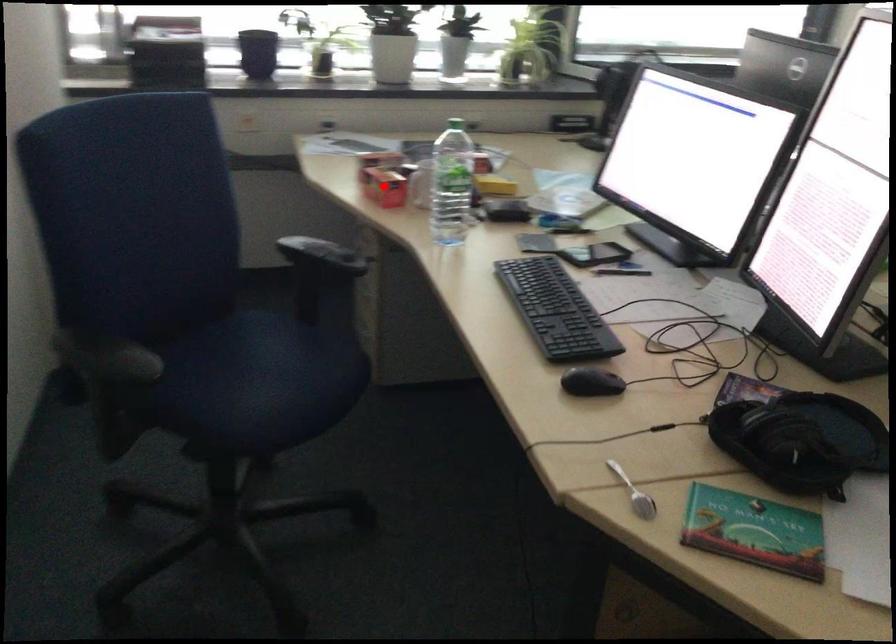
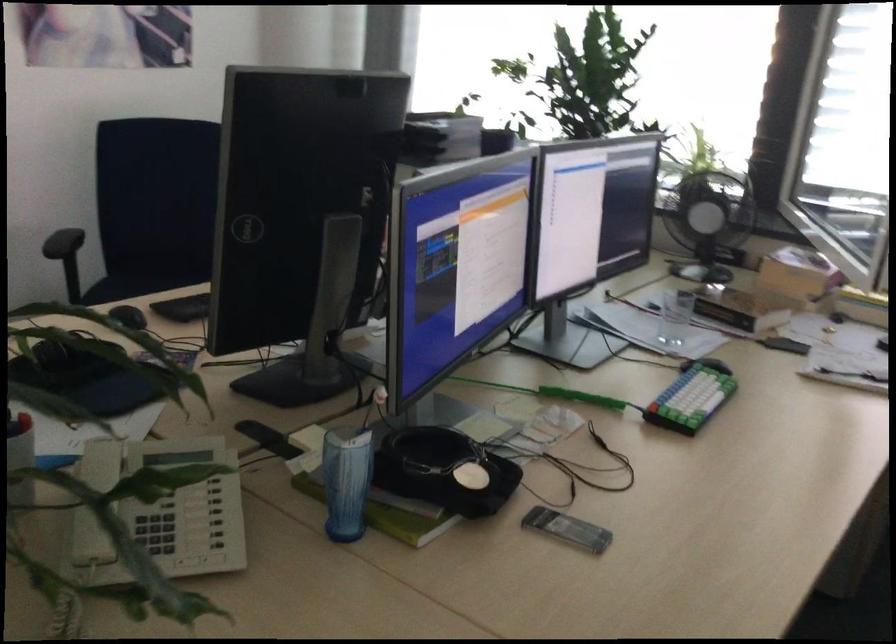
Question: I am providing you with two images of the same scene from different viewpoints. A red point is marked on the first image. Is the red point's position out of view in image 2?

Choices:
 (A) Yes
 (B) No

Answer: (A)